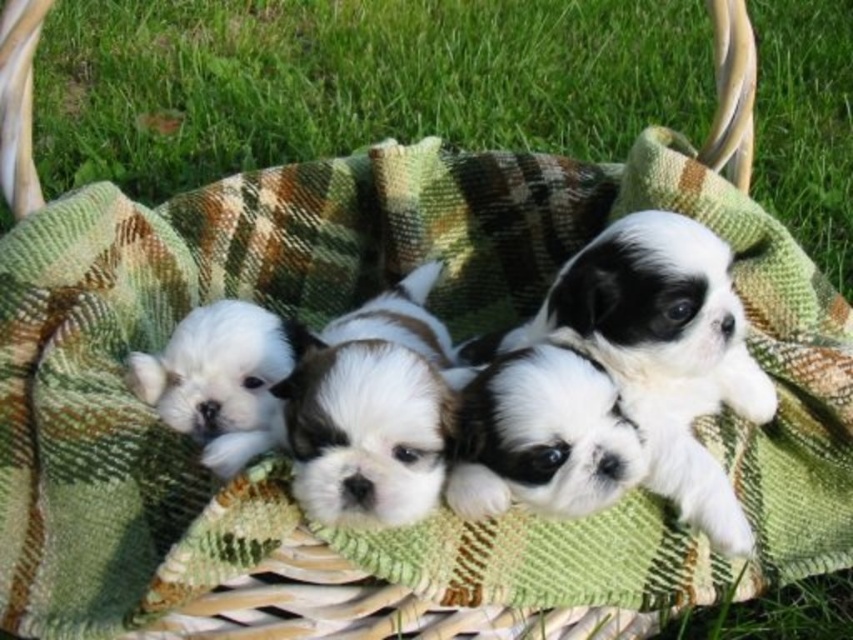
Is point (218, 422) positioned in front of point (6, 182)?

Yes.

Where is `white fluffy puppy at left`? white fluffy puppy at left is located at coordinates (221, 380).

Which is below, black and white fur at center or white fluffy puppy at left?

black and white fur at center is lower down.

How much distance is there between black and white fur at center and white fluffy puppy at left?

black and white fur at center is 12.44 inches away from white fluffy puppy at left.

Is point (637, 216) farther from camera compared to point (207, 433)?

That is False.

This screenshot has width=853, height=640. Identify the location of black and white fur at center. (659, 353).

Can you confirm if white fur at center is positioned to the right of white fluffy dog at center?

No, white fur at center is not to the right of white fluffy dog at center.

Who is more distant from viewer, [314,420] or [519,456]?

The point [519,456] is more distant.

In order to click on white fur at center in this screenshot , I will do `click(373, 410)`.